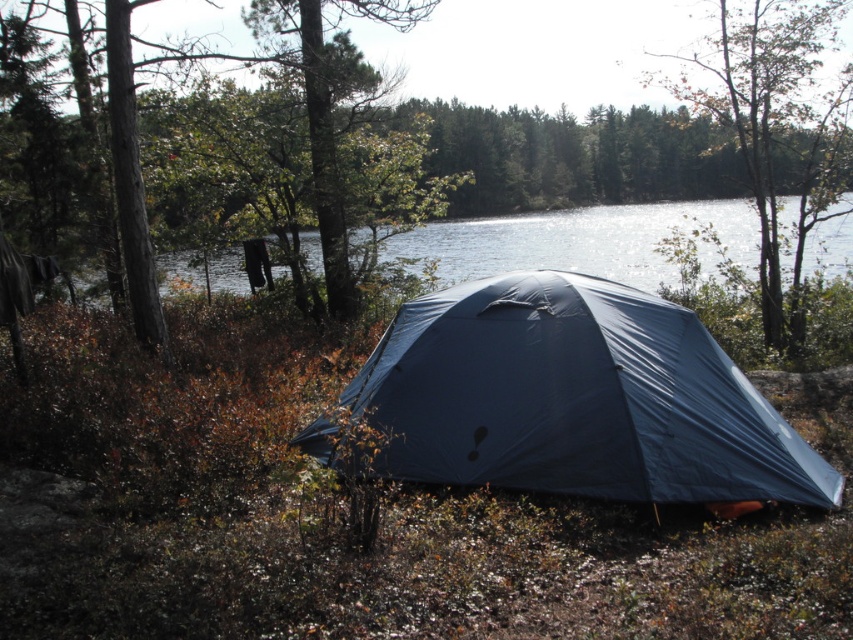
Question: Which point appears closest to the camera in this image?

Choices:
 (A) (440, 264)
 (B) (519, 131)
 (C) (850, 68)

Answer: (C)

Question: Which object is farther from the camera taking this photo?

Choices:
 (A) green matte tree at upper left
 (B) brown wood tree at center

Answer: (B)

Question: Where is green leafy tree at upper center located in relation to transparent blue water at center in the image?

Choices:
 (A) above
 (B) below

Answer: (A)

Question: Can you confirm if brown wood tree at center is positioned to the left of green matte tree at upper left?

Choices:
 (A) no
 (B) yes

Answer: (A)

Question: Does green leafy tree at upper center appear on the right side of transparent blue water at center?

Choices:
 (A) no
 (B) yes

Answer: (B)

Question: Estimate the real-world distances between objects in this image. Which object is closer to the transparent blue water at center?

Choices:
 (A) green matte tree at upper left
 (B) brown wood tree at center
 (C) green leafy tree at upper center

Answer: (B)